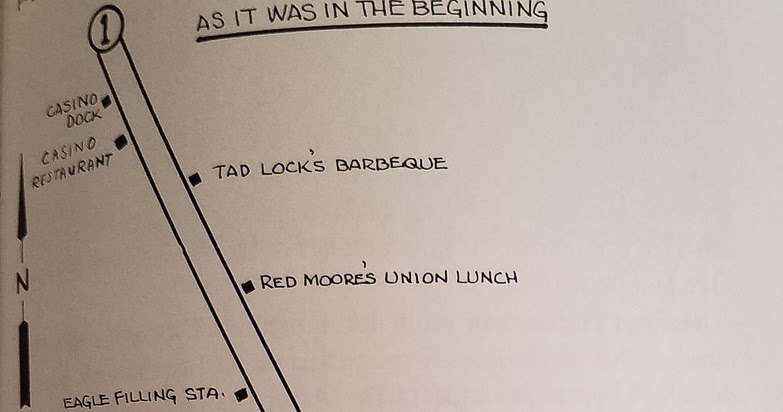
Where is `restaurant`? The width and height of the screenshot is (783, 412). restaurant is located at coordinates (92, 157).